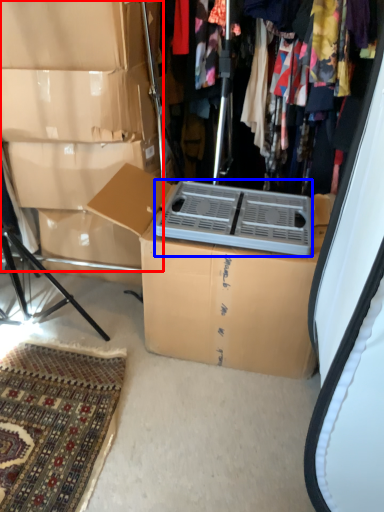
Question: Which object is closer to the camera taking this photo, storage box (highlighted by a red box) or appliance (highlighted by a blue box)?

Choices:
 (A) storage box
 (B) appliance

Answer: (B)